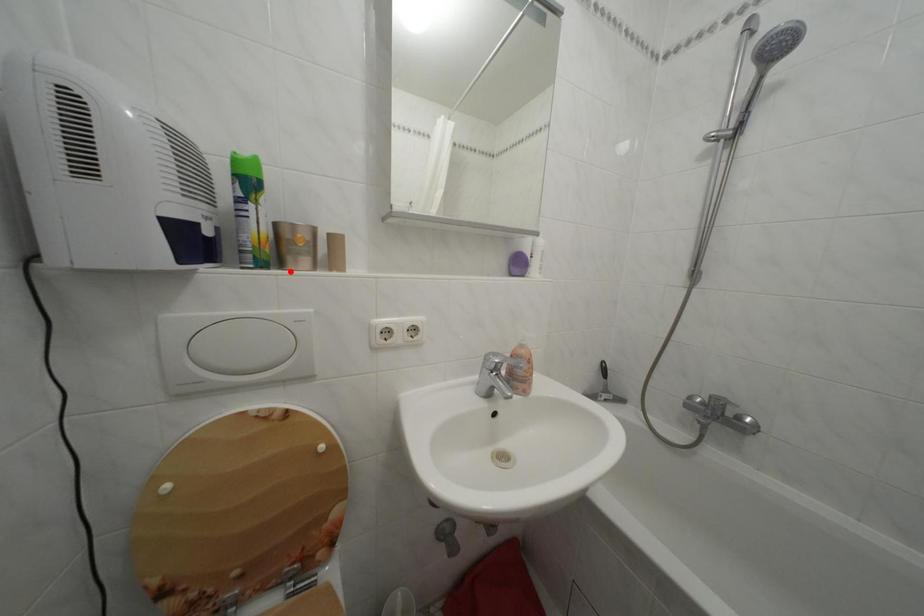
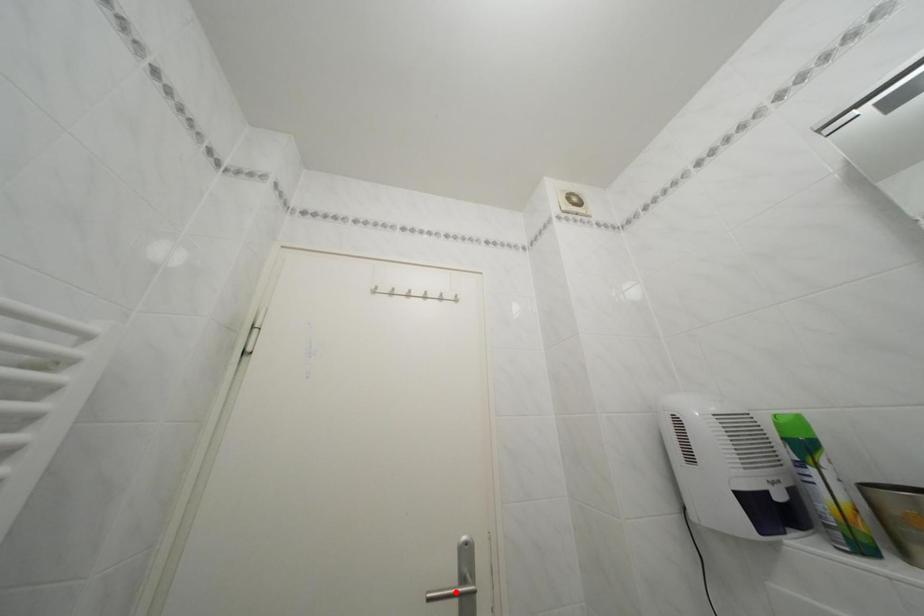
I am providing you with two images of the same scene from different viewpoints. A red point is marked on the first image and another point is marked on the second image. Is the marked point in image1 the same physical position as the marked point in image2?

No